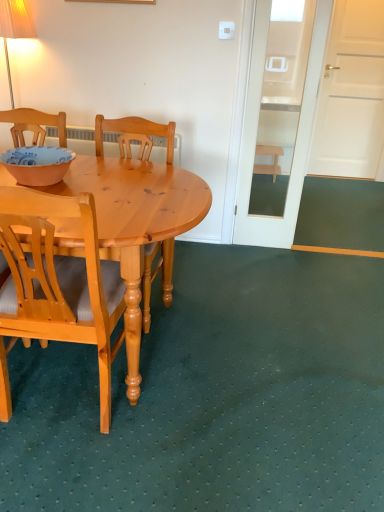
Find the location of a particular element. The height and width of the screenshot is (512, 384). empty space that is to the right of light wood chair at center, which is the second chair from front to back is located at coordinates (217, 307).